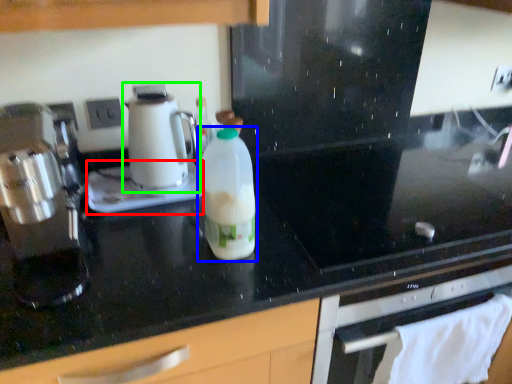
Question: Estimate the real-world distances between objects in this image. Which object is closer to appliance (highlighted by a red box), bottle (highlighted by a blue box) or kitchen appliance (highlighted by a green box)?

Choices:
 (A) bottle
 (B) kitchen appliance

Answer: (B)